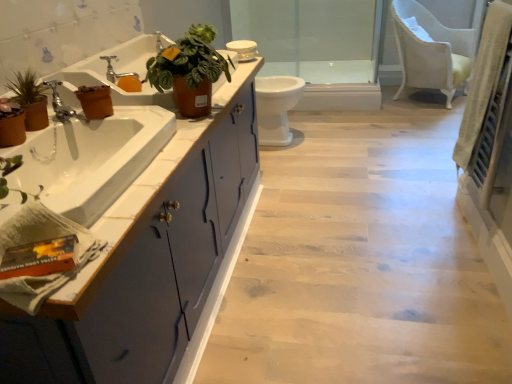
Locate an element on the screen. The width and height of the screenshot is (512, 384). vacant space to the right of white glossy toilet at center is located at coordinates (336, 135).